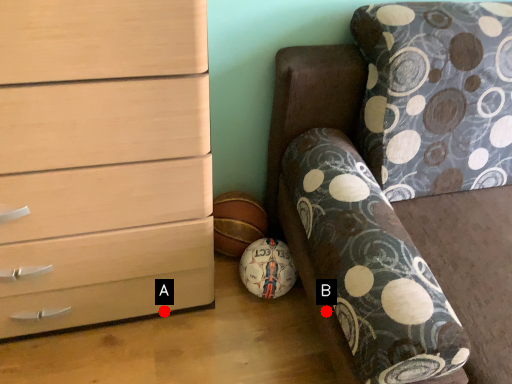
Question: Two points are circled on the image, labeled by A and B beside each circle. Which point is closer to the camera?

Choices:
 (A) A is closer
 (B) B is closer

Answer: (B)